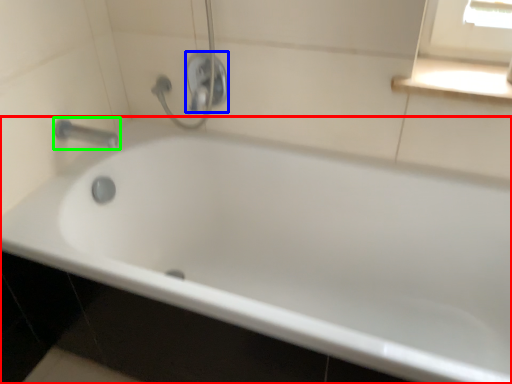
Question: Based on their relative distances, which object is nearer to bathtub (highlighted by a red box)? Choose from shower (highlighted by a blue box) and tap (highlighted by a green box).

Choices:
 (A) shower
 (B) tap

Answer: (A)